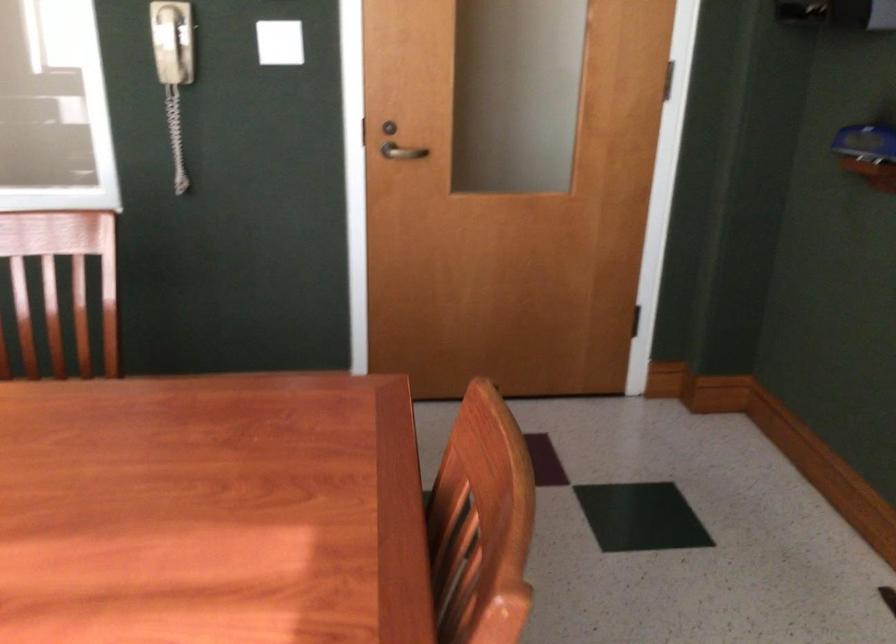
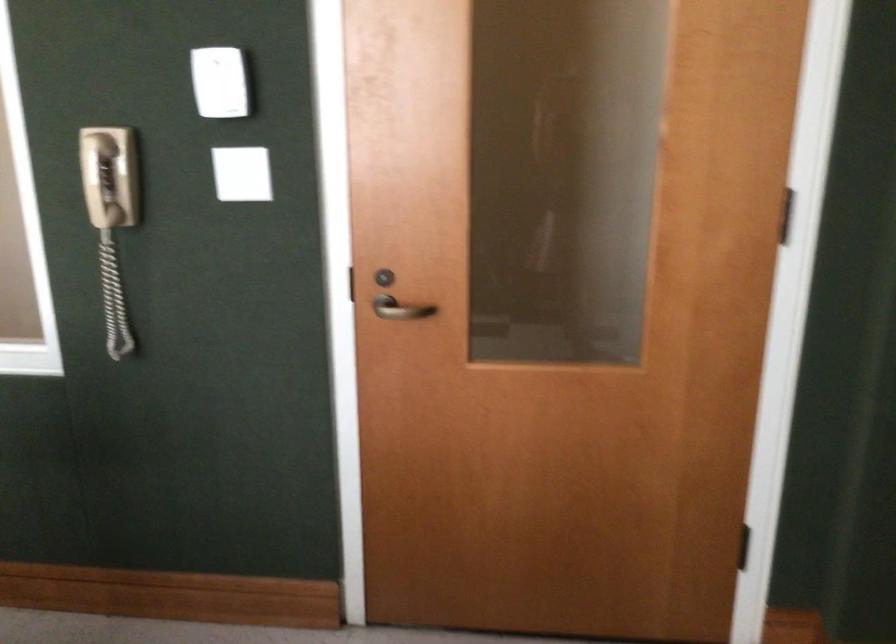
Find the pixel in the second image that matches point 403,147 in the first image.

(401, 308)